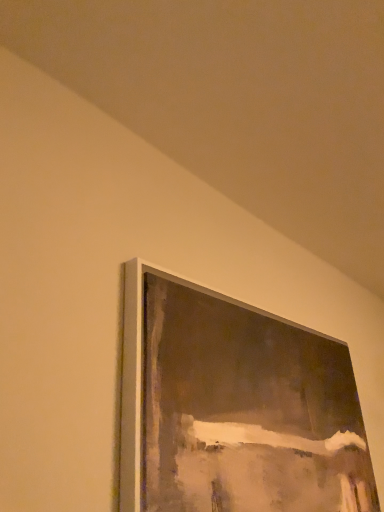
The image size is (384, 512). What do you see at coordinates (234, 407) in the screenshot?
I see `white matte picture frame at upper center` at bounding box center [234, 407].

At what (x,y) coordinates should I click in order to perform the action: click on white matte picture frame at upper center. Please return your answer as a coordinate pair (x, y). Looking at the image, I should click on (234, 407).

This screenshot has height=512, width=384. What are the coordinates of `white matte picture frame at upper center` in the screenshot? It's located at (234, 407).